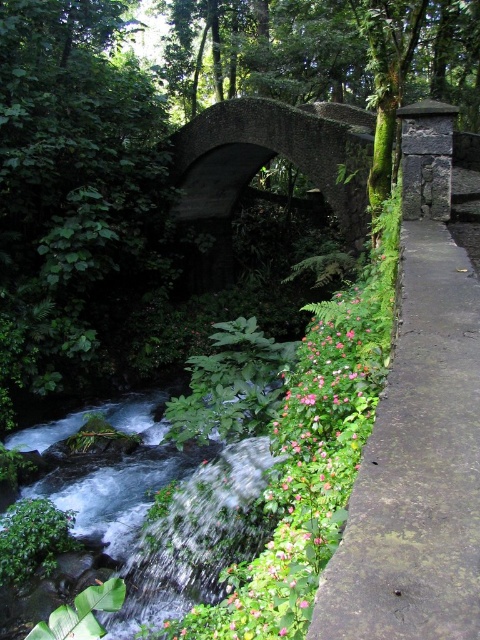
You are standing on the stone bridge and looking at two points in the scene. The first point is at coordinates point (470, 314) and the second is at point (300, 116). Which point is closer to you?

Point (470, 314) is closer to the viewer than point (300, 116).

Looking at this image, you are standing on the stone bridge and looking towards the stream. There is a point marked at coordinates point (417, 467). What is the object located at that point?

The point (417, 467) corresponds to the green mossy concrete pavement at right.

You are standing at the center of the stone bridge and want to locate the pink matte flowers at center. According to the coordinates provided, in which direction should you look relative to your position?

The pink matte flowers at center are located at coordinates point (304, 476), so you should look towards the lower right direction from the center of the stone bridge.